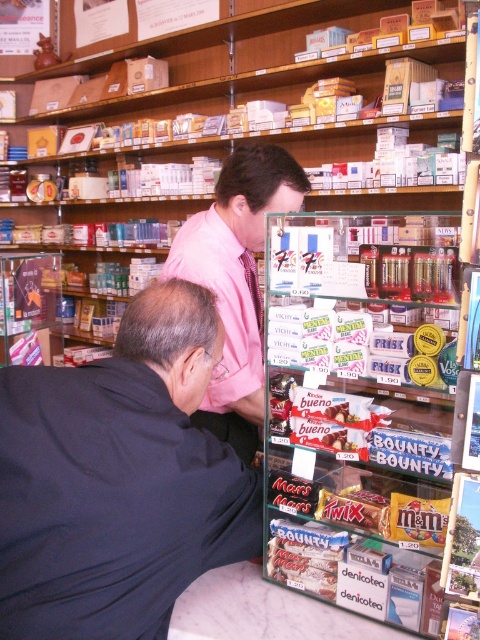
Based on the photo, you are a customer in the store and want to reach both the point at coordinates point (x=152, y=358) and point (x=268, y=170). Which point should you approach first to ensure you can see both points clearly?

You should approach point (x=152, y=358) first because it is closer to the camera, so reaching it first allows you to see both points clearly without obstruction.

You are a customer in the store and want to pick up both the black matte jacket at lower left and the pink shirt at center. If you can only carry one item at a time, which item should you pick first to minimize the distance you walk?

You should pick the black matte jacket at lower left first because it is closer to you than the pink shirt at center, so picking it first would require less walking distance overall.

You are a customer in the store and want to place a black matte jacket at lower left on the counter. The counter is located at point 0.5 on the x axis. Can you walk directly to the counter from your current position without moving any other objects?

The black matte jacket at lower left is located at point 0.750 on the x axis, while the counter is at 0.5. Since the x coordinate of the jacket is higher than the counter, you would need to move left to reach the counter, but the jacket is already at the lower left, so there might be a path obstruction. However, without information about other objects between them, it is uncertain if you can walk directly. The answer cannot be determined with the given data.